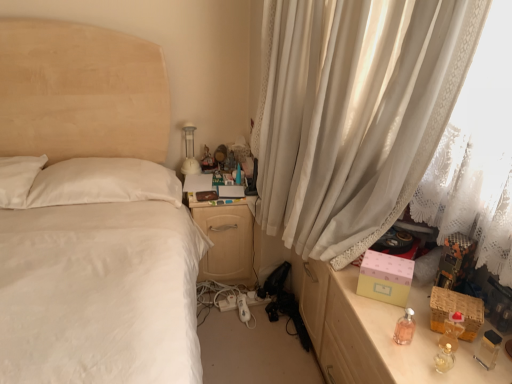
In order to click on vacant area that is situated to the right of pink glass perfume at lower right, which is the second perfume in right-to-left order in this screenshot , I will do `click(431, 337)`.